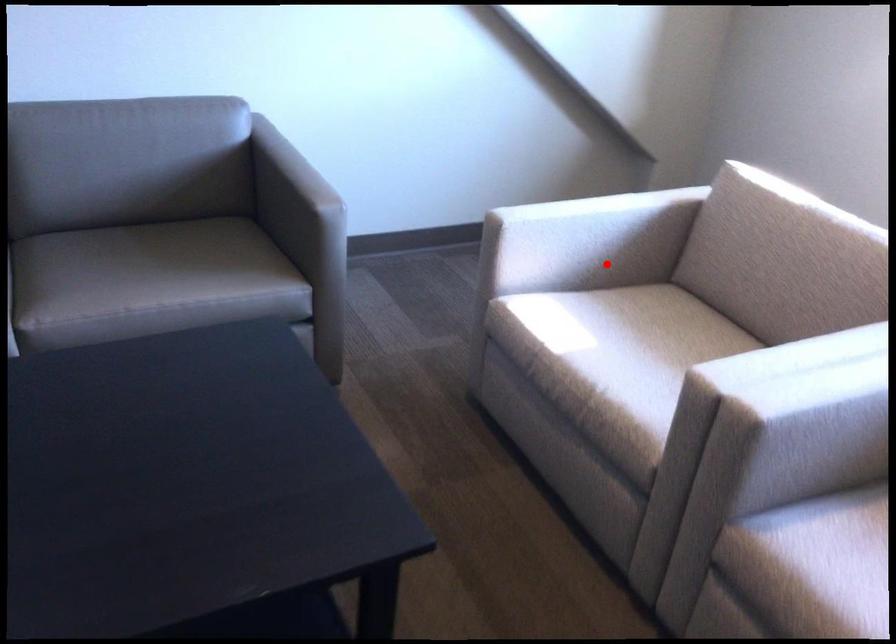
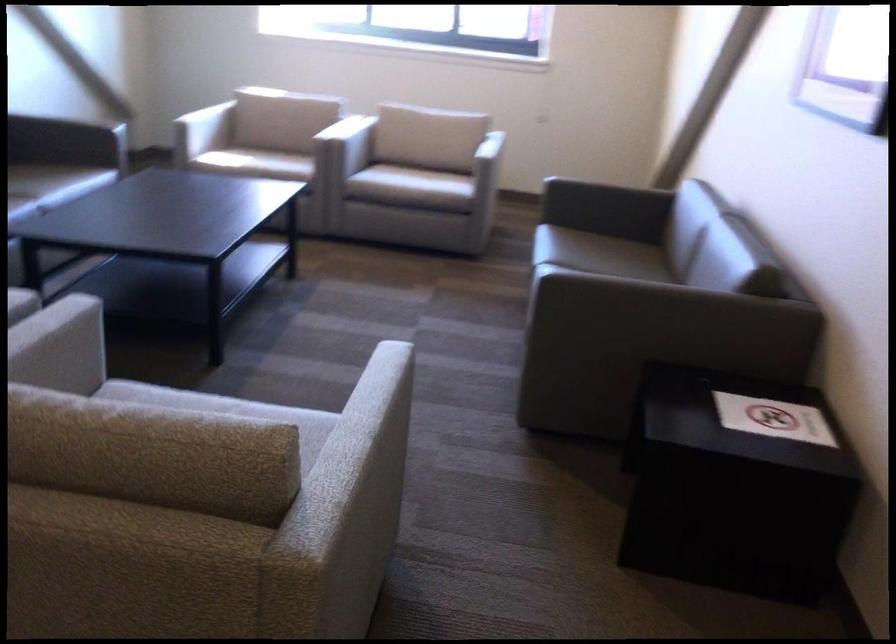
Where in the second image is the point corresponding to the highlighted location from the first image?

(202, 131)